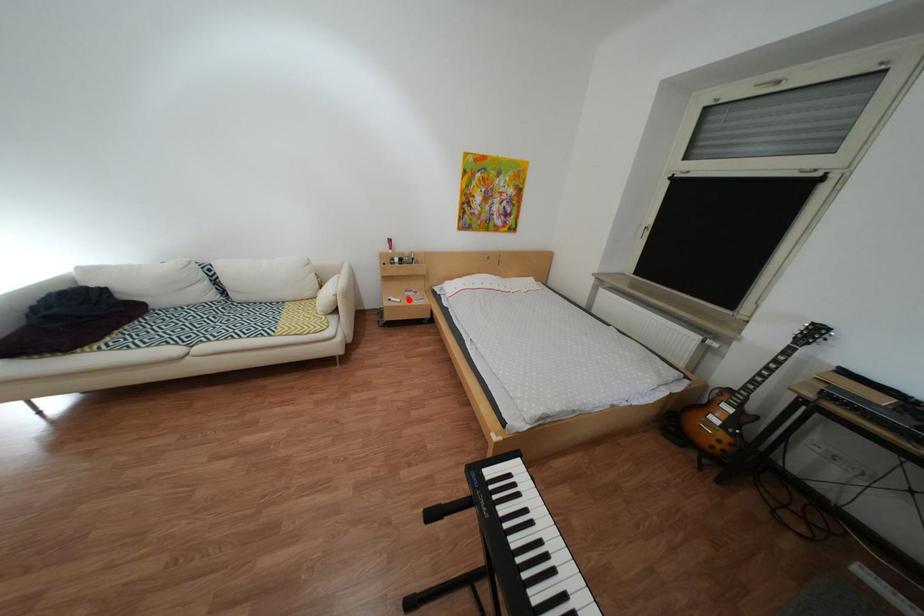
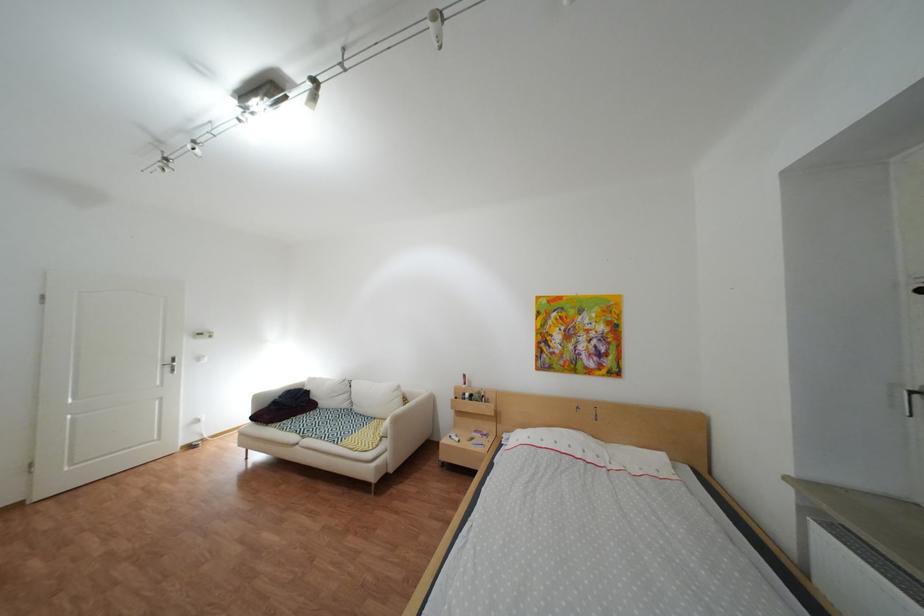
Locate, in the second image, the point that corresponds to the highlighted location in the first image.

(469, 438)